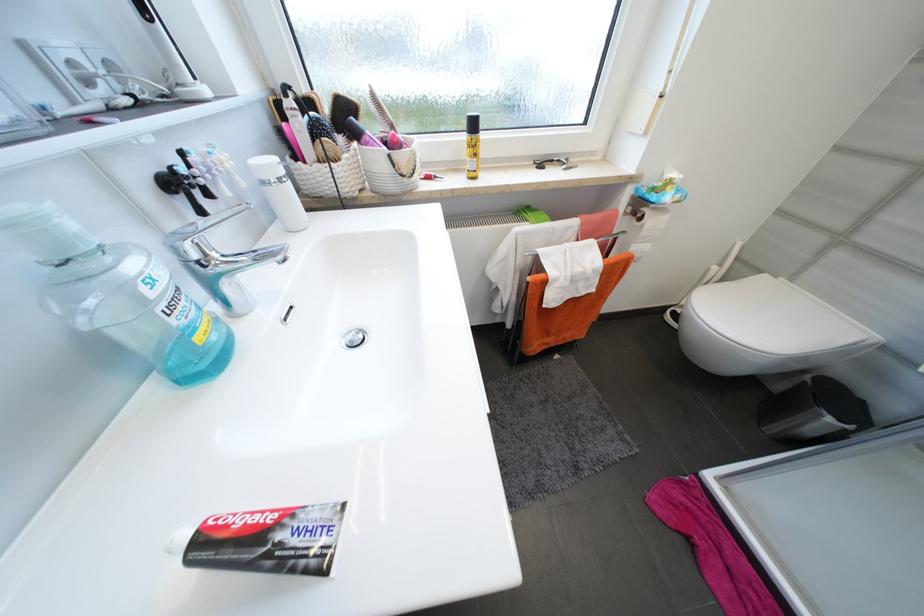
In order to click on black trash can in this screenshot , I will do `click(812, 411)`.